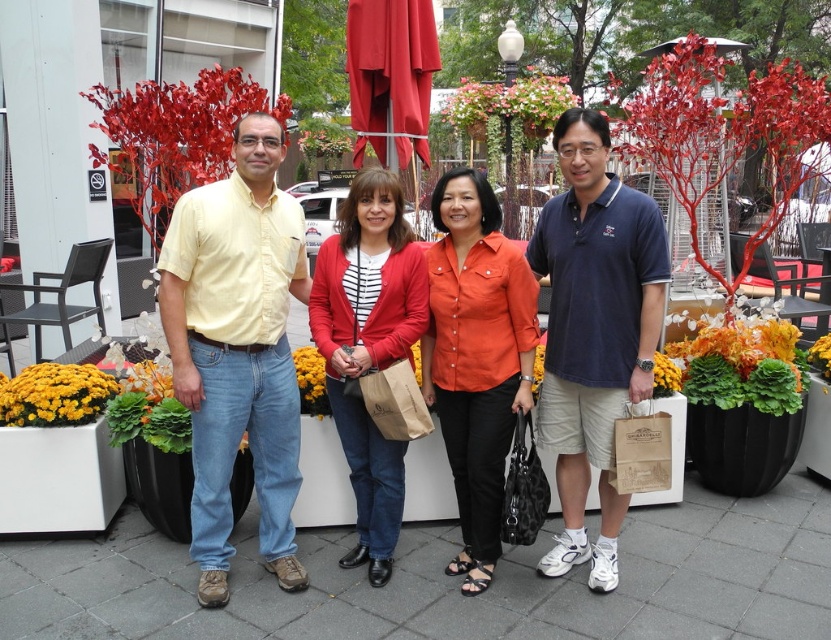
You are standing in the plaza and see the floral arrangement at center and the green leafy plant at center. Which one is positioned to the left?

The floral arrangement at center is positioned to the left of the green leafy plant at center.

You are standing in the plaza and want to find the yellow matte flower at center. According to the coordinates provided, where should you look relative to the central group of people?

The yellow matte flower at center is located at coordinates point (665, 376), which places it slightly to the right and above the central group of people.